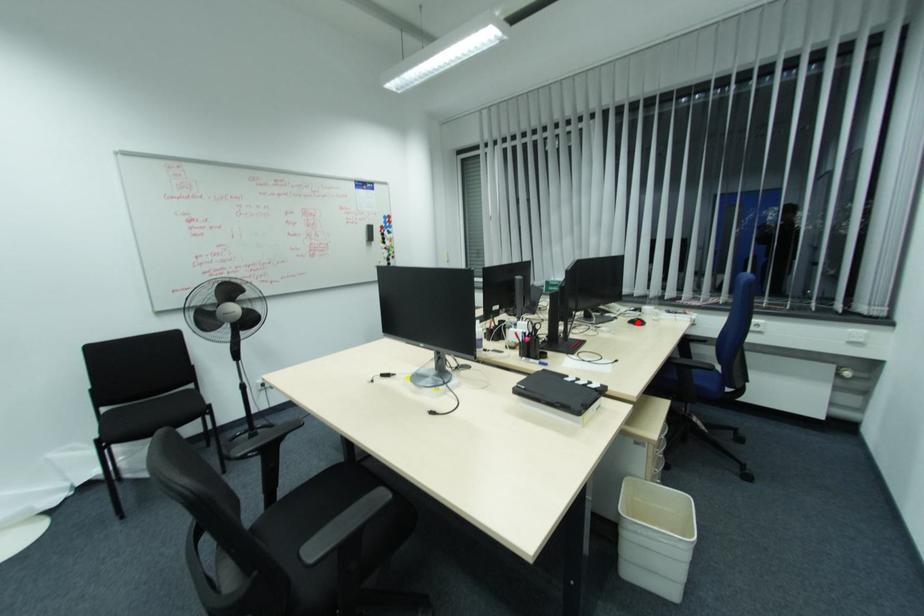
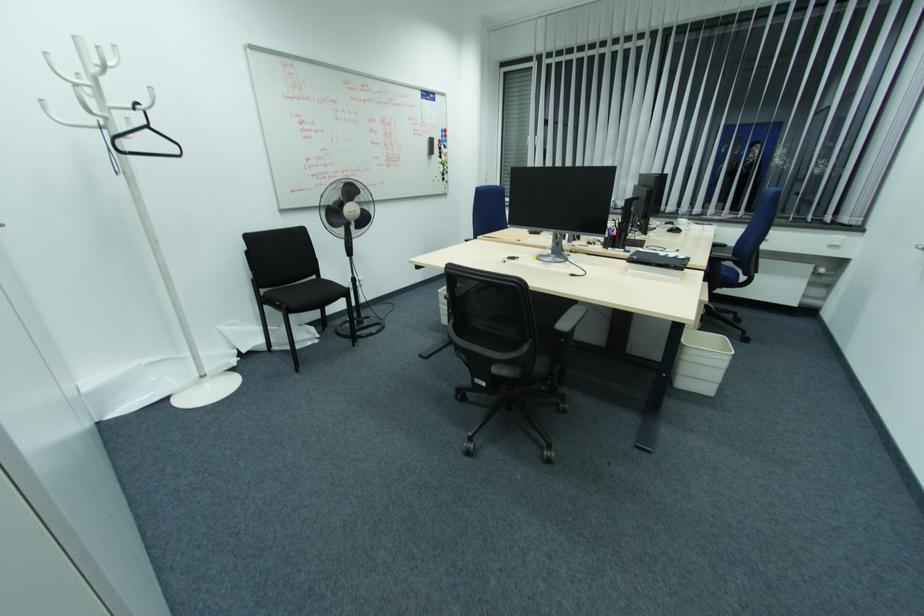
The point at the highlighted location is marked in the first image. Where is the corresponding point in the second image?

(676, 231)